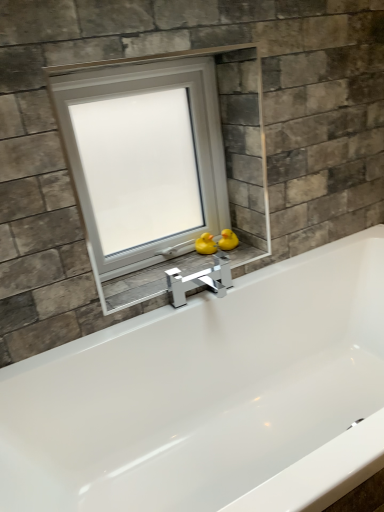
Question: Which direction should I rotate to face yellow rubber duck at center, acting as the 1th duck starting from the left, — up or down?

Choices:
 (A) down
 (B) up

Answer: (B)

Question: From the image's perspective, would you say matte gray stone at center is shown under white plastic window at center?

Choices:
 (A) no
 (B) yes

Answer: (B)

Question: Is matte gray stone at center taller than white plastic window at center?

Choices:
 (A) yes
 (B) no

Answer: (B)

Question: Considering the relative sizes of matte gray stone at center and white plastic window at center in the image provided, is matte gray stone at center smaller than white plastic window at center?

Choices:
 (A) no
 (B) yes

Answer: (B)

Question: Are matte gray stone at center and white plastic window at center far apart?

Choices:
 (A) yes
 (B) no

Answer: (B)

Question: Considering the relative sizes of matte gray stone at center and white plastic window at center in the image provided, is matte gray stone at center shorter than white plastic window at center?

Choices:
 (A) yes
 (B) no

Answer: (A)

Question: Can you confirm if matte gray stone at center is positioned to the left of white plastic window at center?

Choices:
 (A) no
 (B) yes

Answer: (A)

Question: Is yellow rubber duck at center, which is the 2th duck from right to left, positioned beyond the bounds of matte gray stone at center?

Choices:
 (A) yes
 (B) no

Answer: (A)

Question: Is yellow rubber duck at center, which is the 2th duck from right to left, positioned with its back to matte gray stone at center?

Choices:
 (A) no
 (B) yes

Answer: (A)

Question: Is the depth of yellow rubber duck at center, acting as the 1th duck starting from the left, less than that of matte gray stone at center?

Choices:
 (A) no
 (B) yes

Answer: (A)

Question: Would you say yellow rubber duck at center, which is the 2th duck from right to left, contains matte gray stone at center?

Choices:
 (A) yes
 (B) no

Answer: (B)

Question: Considering the relative positions of yellow rubber duck at center, acting as the 1th duck starting from the left, and matte gray stone at center in the image provided, is yellow rubber duck at center, acting as the 1th duck starting from the left, behind matte gray stone at center?

Choices:
 (A) yes
 (B) no

Answer: (A)

Question: From the image's perspective, does yellow rubber duck at center, acting as the 1th duck starting from the left, appear lower than matte gray stone at center?

Choices:
 (A) no
 (B) yes

Answer: (A)

Question: Does matte gray stone at center come in front of yellow rubber duck at center, the first duck viewed from the right?

Choices:
 (A) no
 (B) yes

Answer: (B)